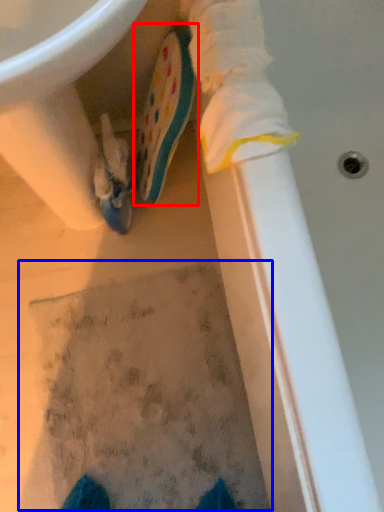
Question: Which object appears farthest to the camera in this image, footwear (highlighted by a red box) or footprint (highlighted by a blue box)?

Choices:
 (A) footwear
 (B) footprint

Answer: (B)